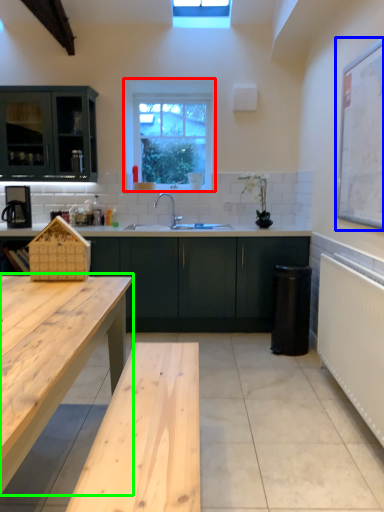
Question: Estimate the real-world distances between objects in this image. Which object is closer to window (highlighted by a red box), bulletin board (highlighted by a blue box) or table (highlighted by a green box)?

Choices:
 (A) bulletin board
 (B) table

Answer: (A)